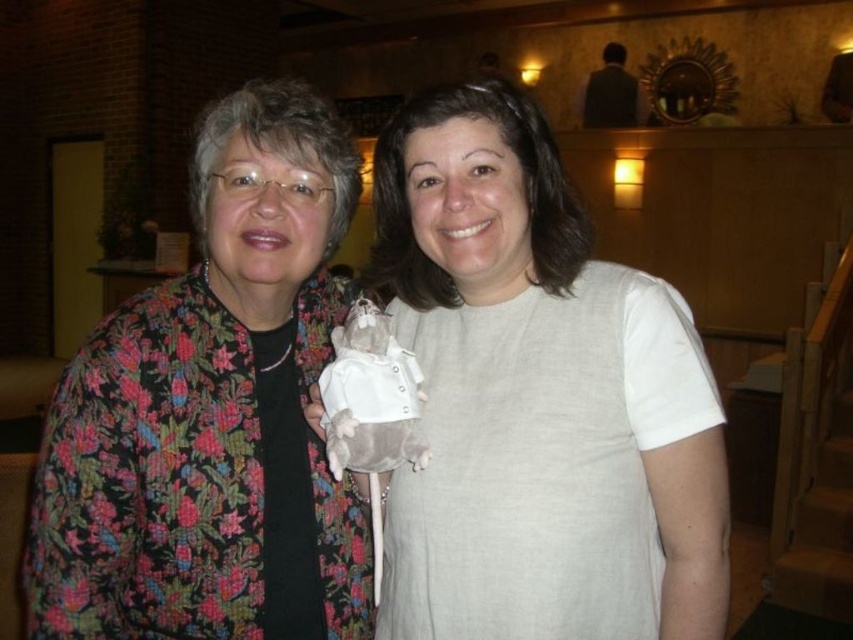
Question: Does white fabric doll at center appear on the right side of floral-patterned jacket at left?

Choices:
 (A) yes
 (B) no

Answer: (A)

Question: Does white fabric doll at center appear under floral-patterned jacket at left?

Choices:
 (A) yes
 (B) no

Answer: (A)

Question: Which point is farther to the camera?

Choices:
 (A) (329, 620)
 (B) (548, 408)

Answer: (A)

Question: Does white fabric doll at center appear on the left side of floral-patterned jacket at left?

Choices:
 (A) no
 (B) yes

Answer: (A)

Question: Which point appears farthest from the camera in this image?

Choices:
 (A) (32, 634)
 (B) (569, 400)

Answer: (A)